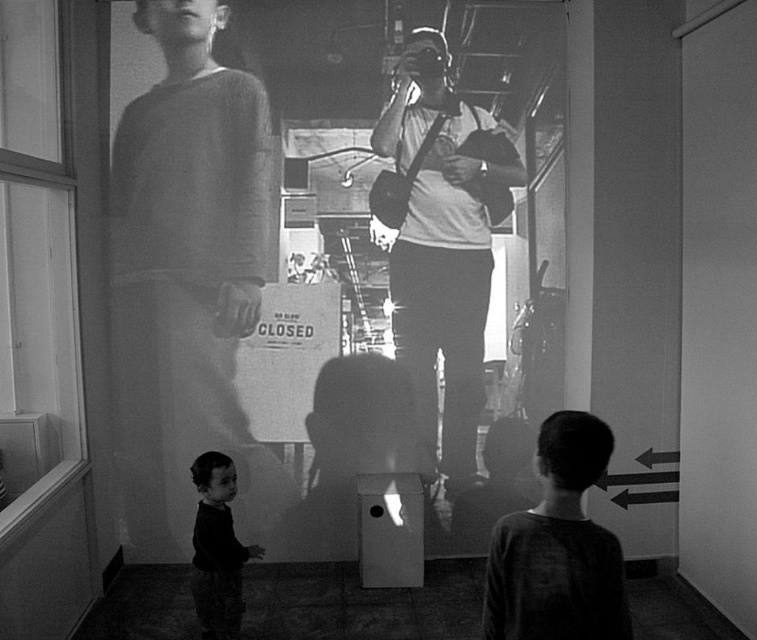
You are a tailor who needs to determine which clothing item requires more fabric based on their sizes. Given the knitted sweater at left and the matte gray shirt at center in the image, which one would need more fabric?

The knitted sweater at left is larger in size than the matte gray shirt at center, so it would require more fabric.

You are a tailor who needs to determine which garment requires more fabric. Based on the image, which of the two garments, the knitted sweater at left or the dark gray textured shirt at lower right, would need more fabric?

The knitted sweater at left requires more fabric because it has a larger size compared to the dark gray textured shirt at lower right.

You are a photographer trying to capture a photo of both the matte gray shirt at center and the dark gray textured shirt at lower right in the scene. Since you can only focus on one area, which shirt should you aim for to ensure both are in the frame?

The matte gray shirt at center is to the left of dark gray textured shirt at lower right, so aiming for the center area between them would keep both in the frame.